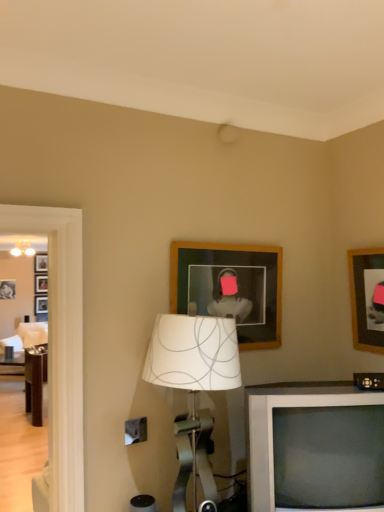
In order to face wooden picture frame at upper center, acting as the 1th picture frame starting from the left, should I rotate leftwards or rightwards?

To align with it, rotate right about 5.611°.

What do you see at coordinates (230, 287) in the screenshot? The width and height of the screenshot is (384, 512). I see `wooden picture frame at upper center, positioned as the 2th picture frame in right-to-left order` at bounding box center [230, 287].

Describe the element at coordinates (314, 447) in the screenshot. I see `white plastic television at lower right` at that location.

Where is `white fabric lampshade at center`? The width and height of the screenshot is (384, 512). white fabric lampshade at center is located at coordinates (193, 385).

Locate an element on the screen. wooden picture frame at upper right, arranged as the second picture frame when viewed from the left is located at coordinates (367, 298).

Does wooden picture frame at upper right, arranged as the first picture frame when viewed from the right, have a greater width compared to white plastic television at lower right?

In fact, wooden picture frame at upper right, arranged as the first picture frame when viewed from the right, might be narrower than white plastic television at lower right.

Are wooden picture frame at upper right, arranged as the second picture frame when viewed from the left, and white plastic television at lower right located far from each other?

That's not correct — wooden picture frame at upper right, arranged as the second picture frame when viewed from the left, is a little close to white plastic television at lower right.

Considering the relative positions of wooden picture frame at upper right, arranged as the first picture frame when viewed from the right, and white plastic television at lower right in the image provided, is wooden picture frame at upper right, arranged as the first picture frame when viewed from the right, to the left of white plastic television at lower right from the viewer's perspective?

No.

Is wooden picture frame at upper right, arranged as the second picture frame when viewed from the left, smaller than white plastic television at lower right?

Yes, wooden picture frame at upper right, arranged as the second picture frame when viewed from the left, is smaller than white plastic television at lower right.

From the image's perspective, between wooden picture frame at upper center, positioned as the 2th picture frame in right-to-left order, and wooden picture frame at upper right, arranged as the first picture frame when viewed from the right, which one is located above?

wooden picture frame at upper center, positioned as the 2th picture frame in right-to-left order, from the image's perspective.

Is wooden picture frame at upper center, acting as the 1th picture frame starting from the left, facing towards wooden picture frame at upper right, arranged as the first picture frame when viewed from the right?

No, wooden picture frame at upper center, acting as the 1th picture frame starting from the left, is not aimed at wooden picture frame at upper right, arranged as the first picture frame when viewed from the right.

Is wooden picture frame at upper center, acting as the 1th picture frame starting from the left, not close to wooden picture frame at upper right, arranged as the second picture frame when viewed from the left?

wooden picture frame at upper center, acting as the 1th picture frame starting from the left, is actually quite close to wooden picture frame at upper right, arranged as the second picture frame when viewed from the left.

At what (x,y) coordinates should I click in order to perform the action: click on picture frame on the right of the wooden picture frame at upper center, acting as the 1th picture frame starting from the left. Please return your answer as a coordinate pair (x, y). Looking at the image, I should click on (367, 298).

Based on the photo, considering the relative sizes of wooden picture frame at upper center, positioned as the 2th picture frame in right-to-left order, and white fabric lampshade at center in the image provided, is wooden picture frame at upper center, positioned as the 2th picture frame in right-to-left order, thinner than white fabric lampshade at center?

Yes, wooden picture frame at upper center, positioned as the 2th picture frame in right-to-left order, is thinner than white fabric lampshade at center.

How different are the orientations of wooden picture frame at upper center, acting as the 1th picture frame starting from the left, and white fabric lampshade at center in degrees?

wooden picture frame at upper center, acting as the 1th picture frame starting from the left, and white fabric lampshade at center are facing 13 degrees away from each other.

Does wooden picture frame at upper center, positioned as the 2th picture frame in right-to-left order, contain white fabric lampshade at center?

No, white fabric lampshade at center is not surrounded by wooden picture frame at upper center, positioned as the 2th picture frame in right-to-left order.

Who is shorter, wooden picture frame at upper center, acting as the 1th picture frame starting from the left, or white fabric lampshade at center?

wooden picture frame at upper center, acting as the 1th picture frame starting from the left.

Does white fabric lampshade at center appear on the right side of wooden picture frame at upper center, positioned as the 2th picture frame in right-to-left order?

No.

Can wooden picture frame at upper center, acting as the 1th picture frame starting from the left, be found inside white fabric lampshade at center?

No, white fabric lampshade at center does not contain wooden picture frame at upper center, acting as the 1th picture frame starting from the left.

Considering the positions of point (206, 478) and point (250, 324), is point (206, 478) closer or farther from the camera than point (250, 324)?

Point (206, 478) is positioned closer to the camera compared to point (250, 324).

The image size is (384, 512). Find the location of `picture frame that is the 1st object located above the white plastic television at lower right (from the image's perspective)`. picture frame that is the 1st object located above the white plastic television at lower right (from the image's perspective) is located at coordinates (367, 298).

Does point (286, 490) lie behind point (369, 311)?

No.

From a real-world perspective, is white plastic television at lower right positioned above or below wooden picture frame at upper right, arranged as the second picture frame when viewed from the left?

white plastic television at lower right is situated lower than wooden picture frame at upper right, arranged as the second picture frame when viewed from the left, in the real world.

Is white plastic television at lower right inside the boundaries of wooden picture frame at upper right, arranged as the first picture frame when viewed from the right, or outside?

white plastic television at lower right is not inside wooden picture frame at upper right, arranged as the first picture frame when viewed from the right, it's outside.

Does white fabric lampshade at center have a greater width compared to wooden picture frame at upper right, arranged as the first picture frame when viewed from the right?

Correct, the width of white fabric lampshade at center exceeds that of wooden picture frame at upper right, arranged as the first picture frame when viewed from the right.

From the image's perspective, is white fabric lampshade at center above or below wooden picture frame at upper right, arranged as the first picture frame when viewed from the right?

Clearly, from the image's perspective, white fabric lampshade at center is below wooden picture frame at upper right, arranged as the first picture frame when viewed from the right.

Does white fabric lampshade at center touch wooden picture frame at upper right, arranged as the first picture frame when viewed from the right?

No, white fabric lampshade at center is not in contact with wooden picture frame at upper right, arranged as the first picture frame when viewed from the right.

Is wooden picture frame at upper right, arranged as the second picture frame when viewed from the left, far from white fabric lampshade at center?

No, wooden picture frame at upper right, arranged as the second picture frame when viewed from the left, is not far from white fabric lampshade at center.

Looking at this image, is white fabric lampshade at center inside wooden picture frame at upper right, arranged as the second picture frame when viewed from the left?

Result: Definitely not — white fabric lampshade at center is not inside wooden picture frame at upper right, arranged as the second picture frame when viewed from the left.

Is point (356, 338) closer or farther from the camera than point (201, 465)?

Point (356, 338).

Could you tell me if wooden picture frame at upper right, arranged as the first picture frame when viewed from the right, is facing white fabric lampshade at center?

Yes, wooden picture frame at upper right, arranged as the first picture frame when viewed from the right, is facing white fabric lampshade at center.

At what (x,y) coordinates should I click in order to perform the action: click on television located on the left of wooden picture frame at upper right, arranged as the first picture frame when viewed from the right. Please return your answer as a coordinate pair (x, y). The height and width of the screenshot is (512, 384). Looking at the image, I should click on (314, 447).

You are a GUI agent. You are given a task and a screenshot of the screen. Output one action in this format:
    pyautogui.click(x=<x>, y=<y>)
    Task: Click on the picture frame above the wooden picture frame at upper right, arranged as the first picture frame when viewed from the right (from the image's perspective)
    Image resolution: width=384 pixels, height=512 pixels.
    Given the screenshot: What is the action you would take?
    (230, 287)

Based on their spatial positions, is white plastic television at lower right or wooden picture frame at upper right, arranged as the second picture frame when viewed from the left, further from white fabric lampshade at center?

wooden picture frame at upper right, arranged as the second picture frame when viewed from the left, lies further to white fabric lampshade at center than the other object.

Estimate the real-world distances between objects in this image. Which object is closer to wooden picture frame at upper center, acting as the 1th picture frame starting from the left, wooden picture frame at upper right, arranged as the second picture frame when viewed from the left, or white plastic television at lower right?

The object closer to wooden picture frame at upper center, acting as the 1th picture frame starting from the left, is wooden picture frame at upper right, arranged as the second picture frame when viewed from the left.

From the image, which object appears to be farther from white plastic television at lower right, wooden picture frame at upper right, arranged as the first picture frame when viewed from the right, or wooden picture frame at upper center, positioned as the 2th picture frame in right-to-left order?

wooden picture frame at upper right, arranged as the first picture frame when viewed from the right.

Estimate the real-world distances between objects in this image. Which object is closer to white fabric lampshade at center, white plastic television at lower right or wooden picture frame at upper center, positioned as the 2th picture frame in right-to-left order?

white plastic television at lower right is closer to white fabric lampshade at center.

Which object lies further to the anchor point white plastic television at lower right, wooden picture frame at upper center, positioned as the 2th picture frame in right-to-left order, or wooden picture frame at upper right, arranged as the first picture frame when viewed from the right?

wooden picture frame at upper right, arranged as the first picture frame when viewed from the right, is further to white plastic television at lower right.

When comparing their distances from wooden picture frame at upper center, positioned as the 2th picture frame in right-to-left order, does white plastic television at lower right or white fabric lampshade at center seem closer?

The object closer to wooden picture frame at upper center, positioned as the 2th picture frame in right-to-left order, is white fabric lampshade at center.

Which object lies nearer to the anchor point white fabric lampshade at center, wooden picture frame at upper right, arranged as the second picture frame when viewed from the left, or wooden picture frame at upper center, acting as the 1th picture frame starting from the left?

Based on the image, wooden picture frame at upper center, acting as the 1th picture frame starting from the left, appears to be nearer to white fabric lampshade at center.

Looking at the image, which one is located further to wooden picture frame at upper center, acting as the 1th picture frame starting from the left, wooden picture frame at upper right, arranged as the first picture frame when viewed from the right, or white fabric lampshade at center?

Among the two, wooden picture frame at upper right, arranged as the first picture frame when viewed from the right, is located further to wooden picture frame at upper center, acting as the 1th picture frame starting from the left.

Identify the location of lamp between wooden picture frame at upper center, positioned as the 2th picture frame in right-to-left order, and white plastic television at lower right from top to bottom. The height and width of the screenshot is (512, 384). (193, 385).

The image size is (384, 512). I want to click on picture frame that lies between wooden picture frame at upper center, positioned as the 2th picture frame in right-to-left order, and white plastic television at lower right from top to bottom, so click(x=367, y=298).

The height and width of the screenshot is (512, 384). I want to click on television between white fabric lampshade at center and wooden picture frame at upper right, arranged as the first picture frame when viewed from the right, in the horizontal direction, so click(314, 447).

You are a GUI agent. You are given a task and a screenshot of the screen. Output one action in this format:
    pyautogui.click(x=<x>, y=<y>)
    Task: Click on the picture frame between white fabric lampshade at center and wooden picture frame at upper right, arranged as the second picture frame when viewed from the left, from left to right
    
    Given the screenshot: What is the action you would take?
    pyautogui.click(x=230, y=287)